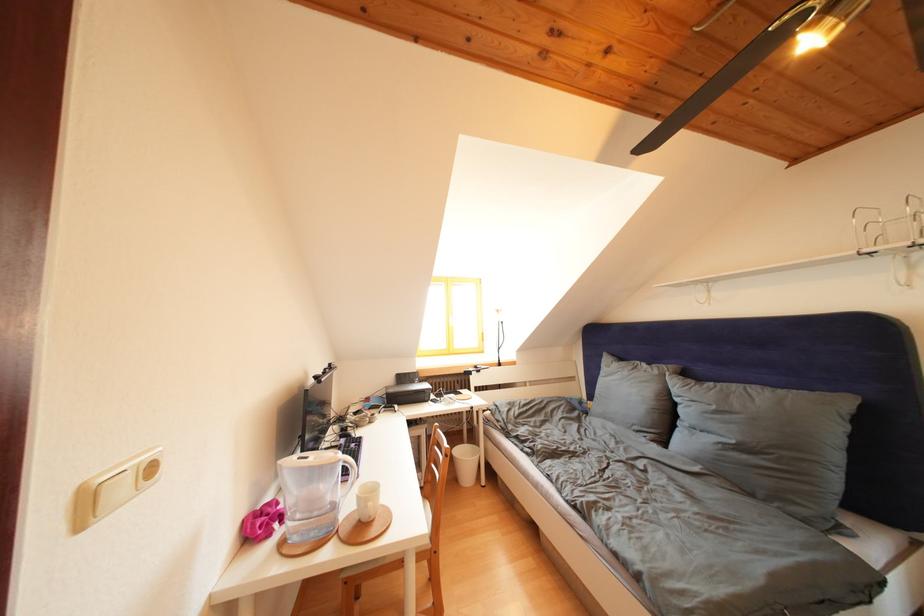
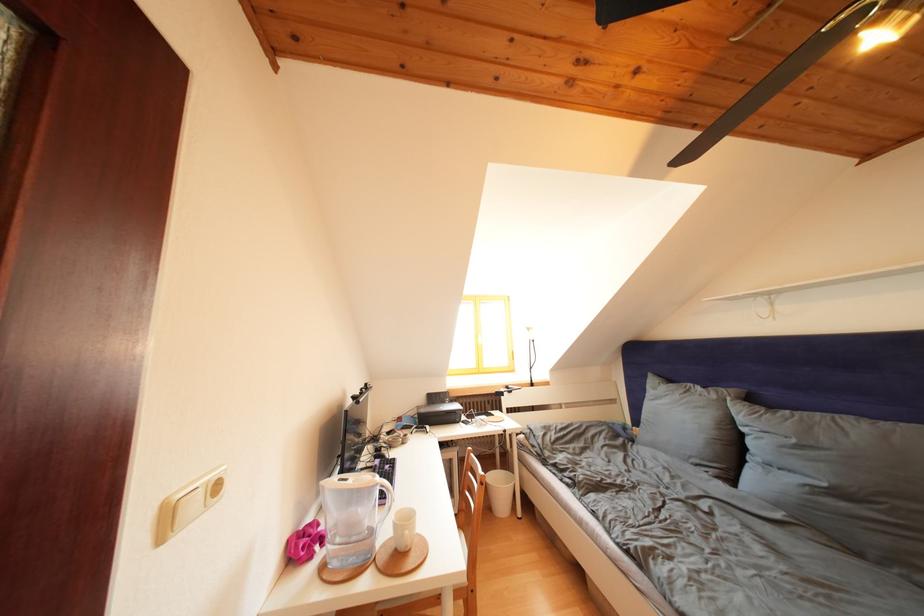
Where in the second image is the point corresponding to point (348, 459) from the first image?

(385, 482)